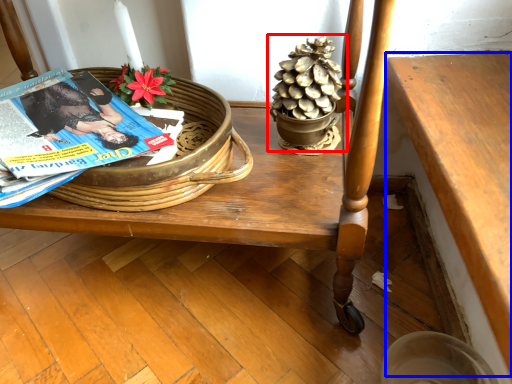
Question: Which of the following is the farthest to the observer, houseplant (highlighted by a red box) or table (highlighted by a blue box)?

Choices:
 (A) houseplant
 (B) table

Answer: (A)